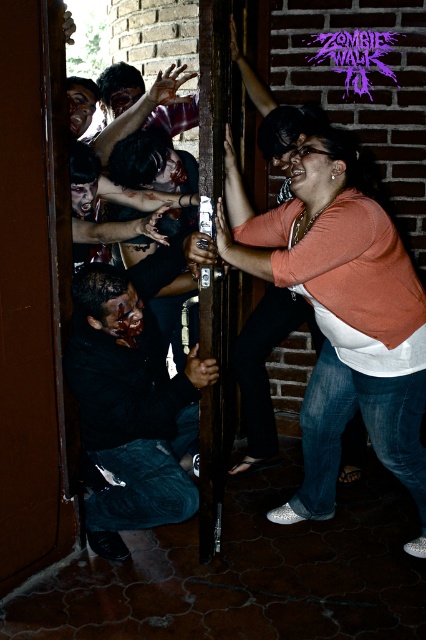
Can you confirm if orange matte shirt at upper right is bigger than dark matte shirt at center?

Yes, orange matte shirt at upper right is bigger than dark matte shirt at center.

This screenshot has height=640, width=426. I want to click on orange matte shirt at upper right, so click(339, 314).